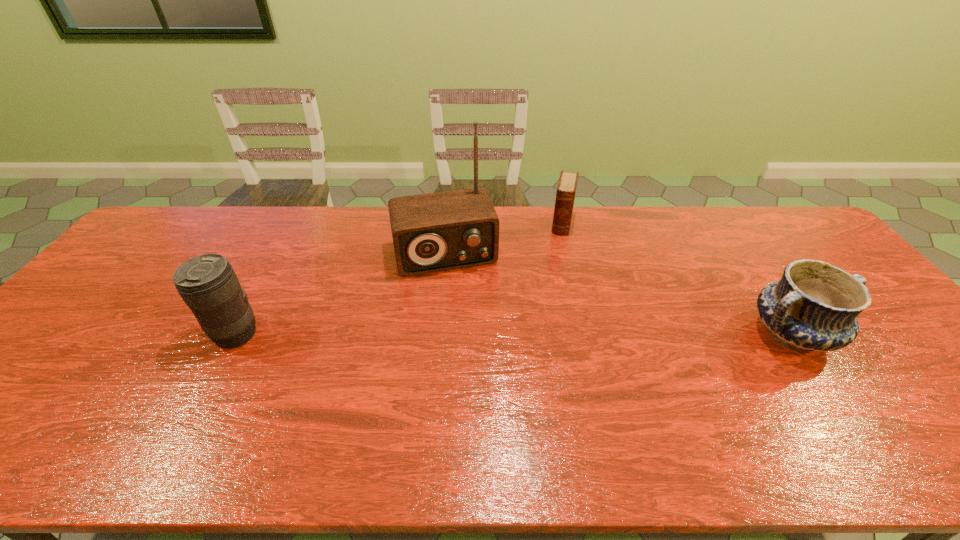
You are a GUI agent. You are given a task and a screenshot of the screen. Output one action in this format:
    pyautogui.click(x=<x>, y=<y>)
    Task: Click on the vacant area located 0.200m on the front-facing side of the third object from right to left
    This screenshot has height=540, width=960.
    Given the screenshot: What is the action you would take?
    pyautogui.click(x=469, y=326)

Find the location of a particular element. This screenshot has height=540, width=960. blank space located 0.200m on the front-facing side of the third object from right to left is located at coordinates (x=469, y=326).

You are a GUI agent. You are given a task and a screenshot of the screen. Output one action in this format:
    pyautogui.click(x=<x>, y=<y>)
    Task: Click on the free location located on the front-facing side of the third object from right to left
    
    Given the screenshot: What is the action you would take?
    pyautogui.click(x=478, y=359)

This screenshot has height=540, width=960. Identify the location of free point located 0.160m on the spine side of the third object from left to right. (556, 266).

Locate an element on the screen. vacant space located on the spine side of the third object from left to right is located at coordinates (552, 286).

Image resolution: width=960 pixels, height=540 pixels. Find the location of `free space located 0.280m on the spine side of the third object from left to right`. free space located 0.280m on the spine side of the third object from left to right is located at coordinates (551, 293).

Where is `radio receiver positioned at the far edge`? This screenshot has width=960, height=540. radio receiver positioned at the far edge is located at coordinates (433, 232).

I want to click on diary that is at the far edge, so click(566, 189).

In the image, there is a desktop. Where is `free space at the far edge`? The image size is (960, 540). free space at the far edge is located at coordinates (272, 210).

Where is `free region at the near edge`? The image size is (960, 540). free region at the near edge is located at coordinates (711, 402).